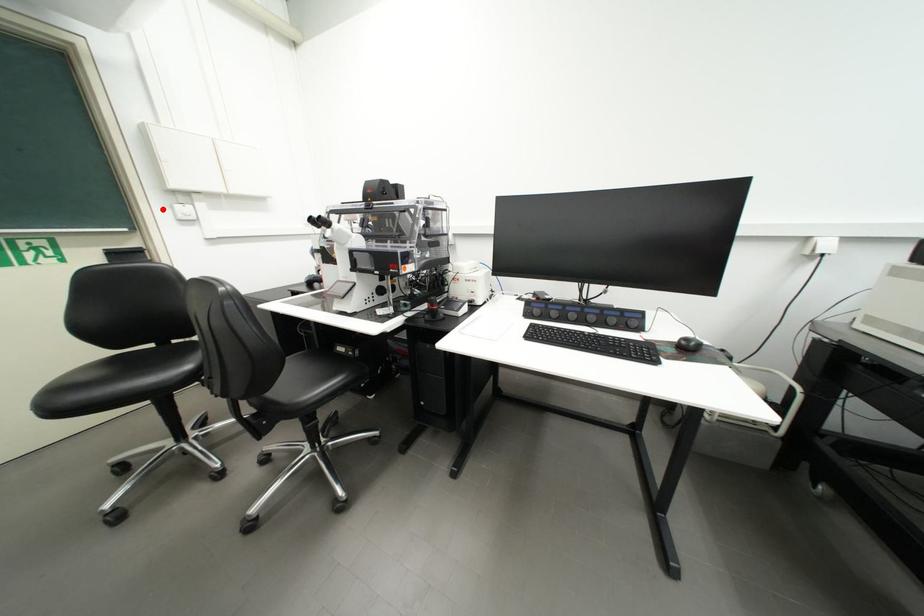
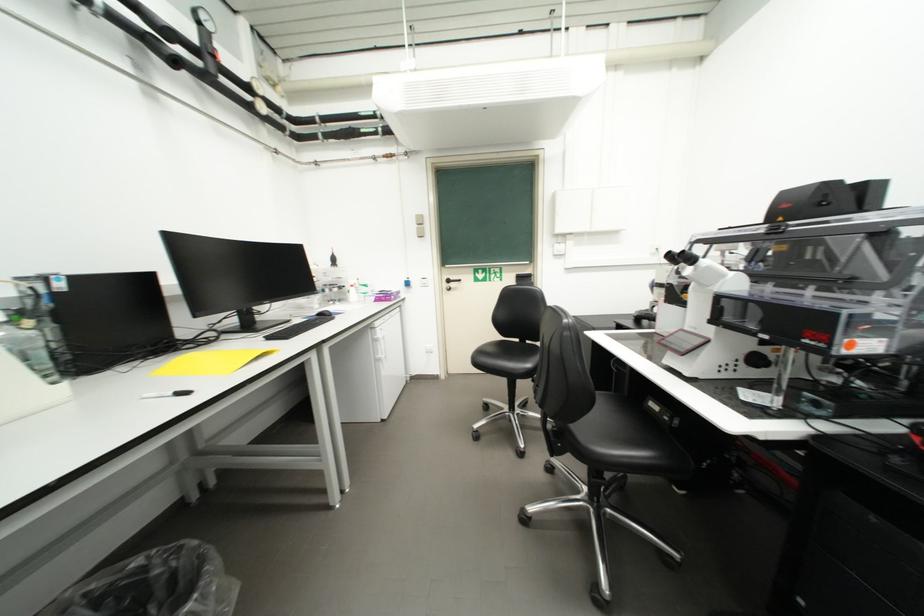
Question: I am providing you with two images of the same scene from different viewpoints. A red point is shown in image1. For the corresponding object point in image2, is it positioned nearer or farther from the camera?

Choices:
 (A) Nearer
 (B) Farther

Answer: (A)